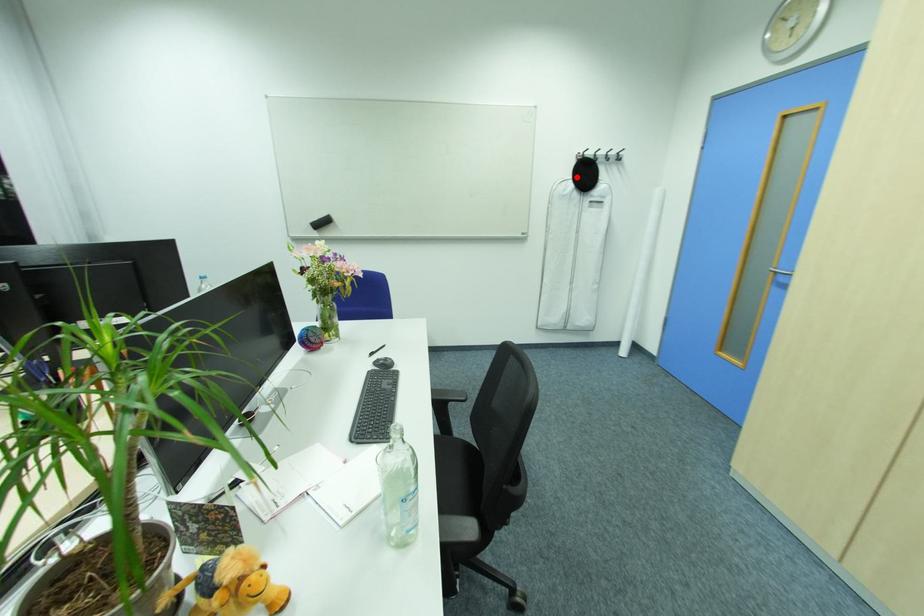
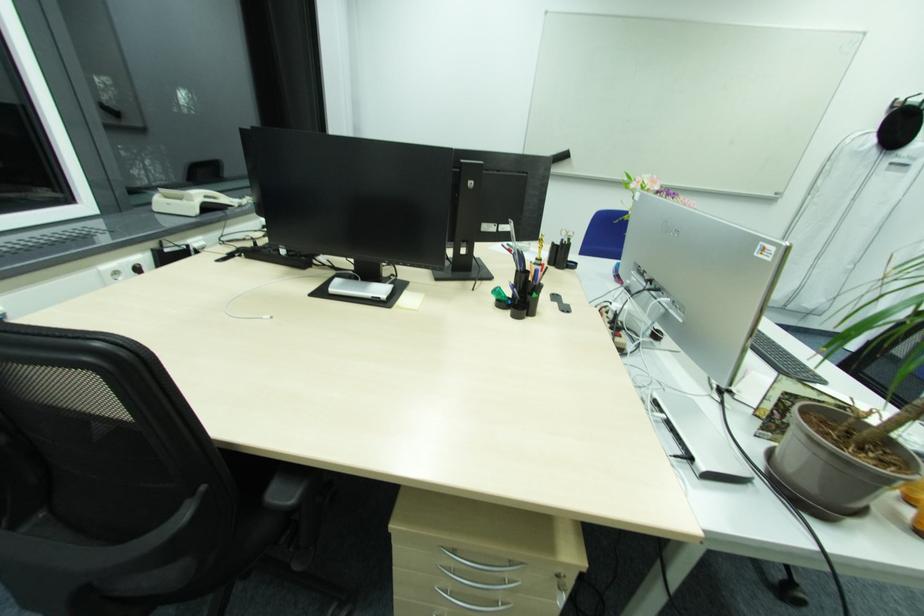
The point at the highlighted location is marked in the first image. Where is the corresponding point in the second image?

(881, 130)